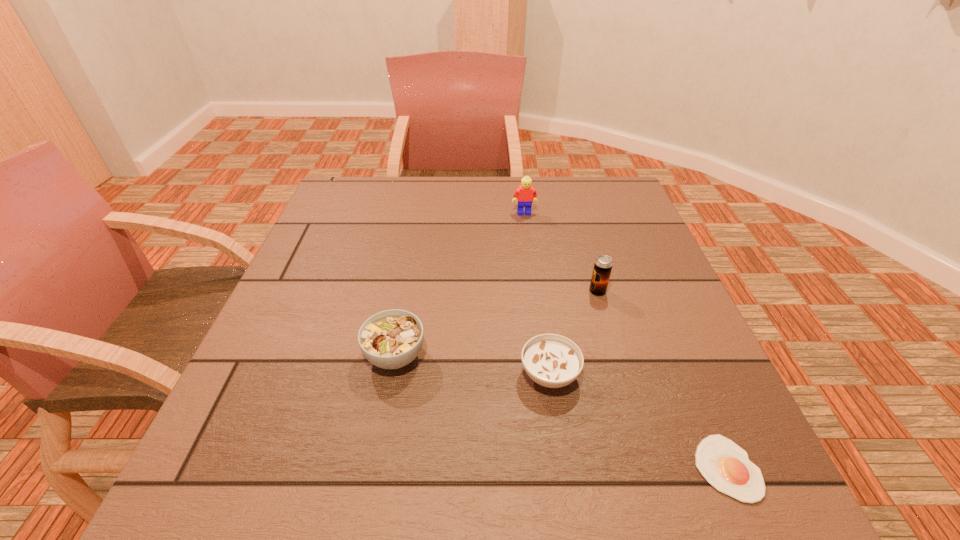
Identify the location of vacant area located on the front-facing side of the farthest object. The image size is (960, 540). (538, 312).

Image resolution: width=960 pixels, height=540 pixels. Find the location of `free space located 0.380m on the front of the fourth object from left to right`. free space located 0.380m on the front of the fourth object from left to right is located at coordinates (647, 460).

At what (x,y) coordinates should I click in order to perform the action: click on vacant area situated 0.140m on the right of the taller soup bowl. Please return your answer as a coordinate pair (x, y). This screenshot has height=540, width=960. Looking at the image, I should click on (497, 355).

Where is `free spot located on the left of the shorter soup bowl`? Image resolution: width=960 pixels, height=540 pixels. free spot located on the left of the shorter soup bowl is located at coordinates (472, 374).

Where is `vacant space located on the left of the nearest object`? vacant space located on the left of the nearest object is located at coordinates (632, 468).

The image size is (960, 540). I want to click on object at the far edge, so click(524, 194).

Identify the location of object located at the near edge. Image resolution: width=960 pixels, height=540 pixels. (726, 466).

What are the coordinates of `beer can located at the right edge` in the screenshot? It's located at (603, 264).

Image resolution: width=960 pixels, height=540 pixels. In order to click on egg yolk positioned at the right edge in this screenshot , I will do `click(726, 466)`.

Find the location of a particular element. object at the near right corner is located at coordinates pyautogui.click(x=726, y=466).